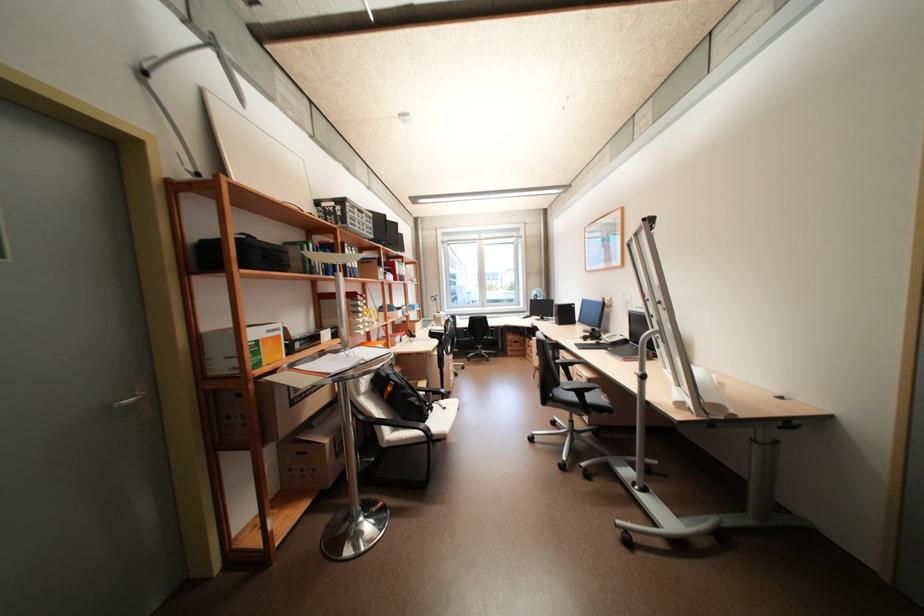
This screenshot has height=616, width=924. Describe the element at coordinates (395, 421) in the screenshot. I see `a white chair armrest` at that location.